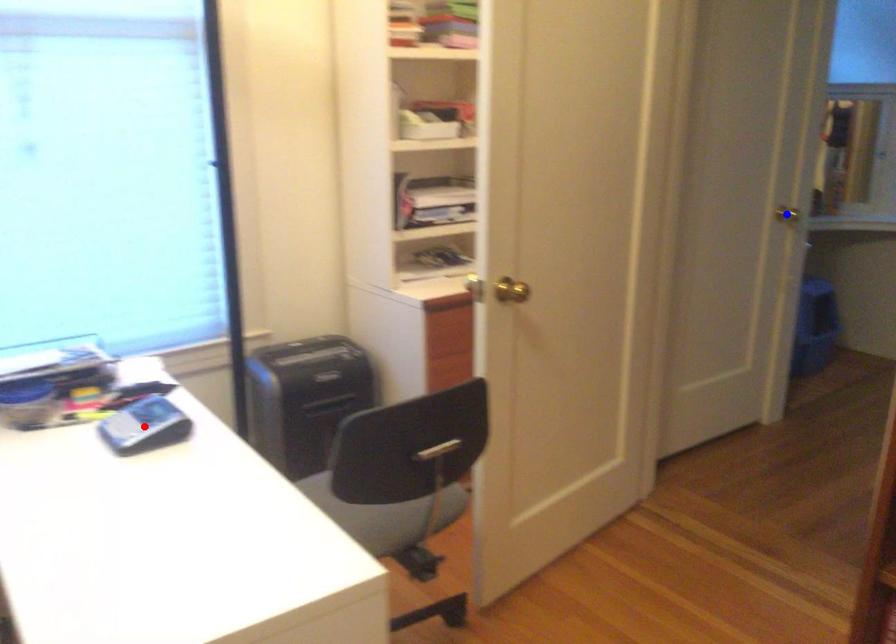
Question: Two points are marked on the image. Which point is closer to the camera?

Choices:
 (A) Blue point is closer.
 (B) Red point is closer.

Answer: (B)